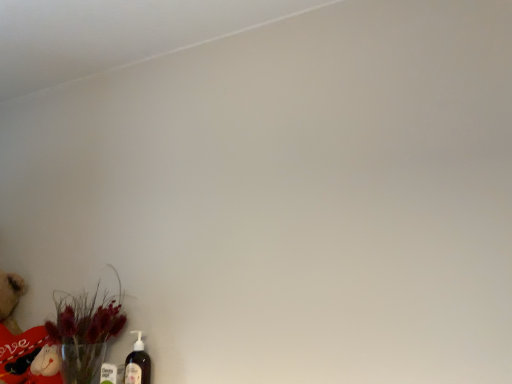
Question: Is translucent plastic bottle at lower left turned away from translucent glass vase at lower left?

Choices:
 (A) no
 (B) yes

Answer: (A)

Question: Is translucent plastic bottle at lower left beside translucent glass vase at lower left?

Choices:
 (A) no
 (B) yes

Answer: (A)

Question: Is translucent plastic bottle at lower left at the right side of translucent glass vase at lower left?

Choices:
 (A) yes
 (B) no

Answer: (A)

Question: Considering the relative positions of translucent plastic bottle at lower left and translucent glass vase at lower left in the image provided, is translucent plastic bottle at lower left behind translucent glass vase at lower left?

Choices:
 (A) no
 (B) yes

Answer: (B)

Question: Is translucent plastic bottle at lower left thinner than translucent glass vase at lower left?

Choices:
 (A) yes
 (B) no

Answer: (A)

Question: Does translucent plastic bottle at lower left appear on the left side of translucent glass vase at lower left?

Choices:
 (A) no
 (B) yes

Answer: (A)

Question: From a real-world perspective, is translucent glass vase at lower left positioned over translucent plastic bottle at lower left based on gravity?

Choices:
 (A) yes
 (B) no

Answer: (A)

Question: Could you tell me if translucent glass vase at lower left is turned towards translucent plastic bottle at lower left?

Choices:
 (A) no
 (B) yes

Answer: (A)

Question: Is translucent glass vase at lower left further to the viewer compared to translucent plastic bottle at lower left?

Choices:
 (A) no
 (B) yes

Answer: (A)

Question: Is translucent glass vase at lower left far away from translucent plastic bottle at lower left?

Choices:
 (A) no
 (B) yes

Answer: (A)

Question: Is translucent glass vase at lower left not inside translucent plastic bottle at lower left?

Choices:
 (A) no
 (B) yes

Answer: (B)

Question: Can you confirm if translucent glass vase at lower left is positioned to the right of translucent plastic bottle at lower left?

Choices:
 (A) no
 (B) yes

Answer: (A)

Question: In the image, is translucent plastic bottle at lower left positioned in front of or behind translucent glass vase at lower left?

Choices:
 (A) front
 (B) behind

Answer: (B)